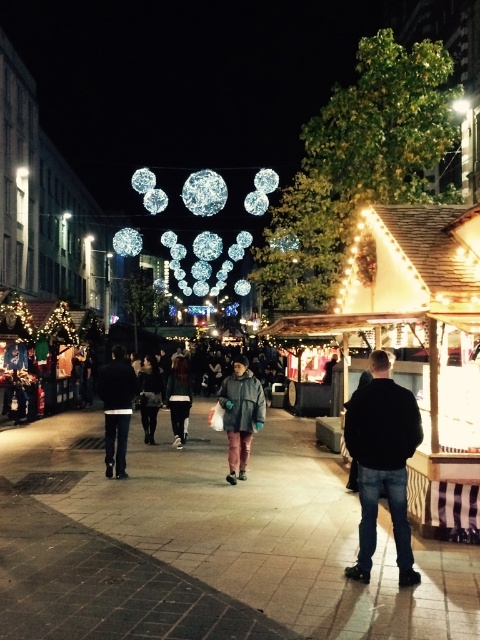
Question: Among these points, which one is farthest from the camera?

Choices:
 (A) (112, 456)
 (B) (239, 358)
 (C) (373, 532)
 (D) (176, 378)

Answer: (D)

Question: Does black matte jacket at center have a smaller size compared to dark gray jacket at center?

Choices:
 (A) no
 (B) yes

Answer: (A)

Question: Is dark gray hoodie at center thinner than dark gray jacket at center?

Choices:
 (A) yes
 (B) no

Answer: (B)

Question: Does black matte jacket at center appear on the left side of matte gray coat at center?

Choices:
 (A) yes
 (B) no

Answer: (B)

Question: Which point is closer to the camera?

Choices:
 (A) black matte jacket at center
 (B) dark gray hoodie at center
 (C) dark gray jacket at center
 (D) matte gray coat at center

Answer: (A)

Question: Which point appears farthest from the camera in this image?

Choices:
 (A) (142, 380)
 (B) (391, 403)
 (C) (243, 369)

Answer: (A)